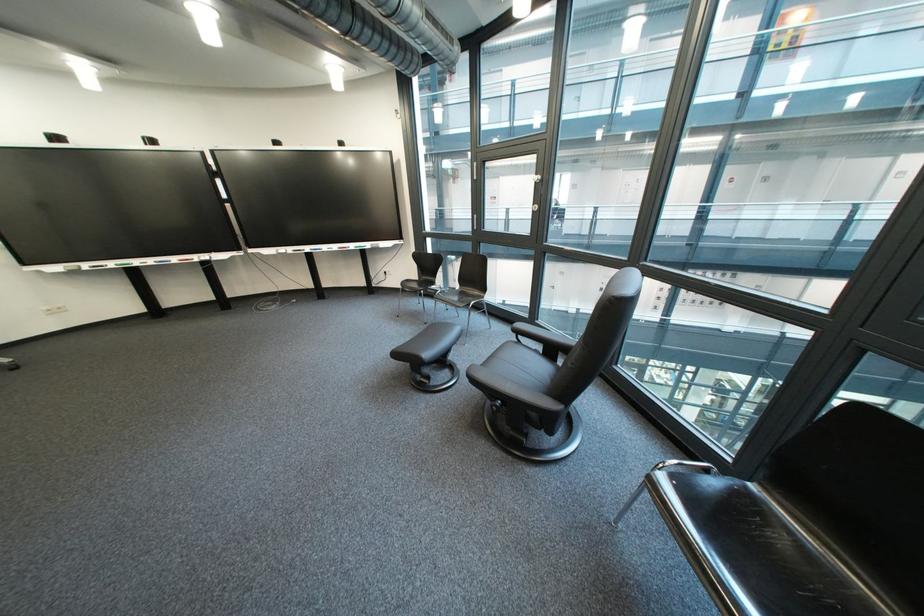
Describe the element at coordinates (512, 391) in the screenshot. I see `the black leather armrest` at that location.